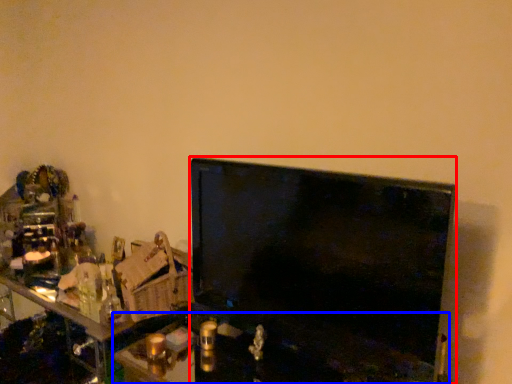
Question: Which object is closer to the camera taking this photo, television (highlighted by a red box) or computer (highlighted by a blue box)?

Choices:
 (A) television
 (B) computer

Answer: (B)